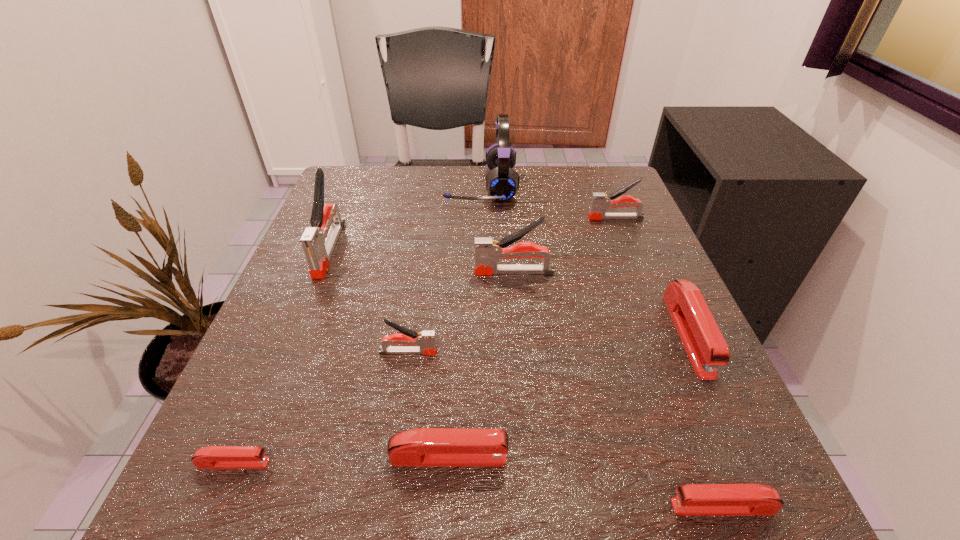
I want to click on unoccupied position between the smallest gray stapler and the nearest object, so click(565, 429).

Find the location of `unoccupied area between the second red stapler from left to right and the nearest object`. unoccupied area between the second red stapler from left to right and the nearest object is located at coordinates (586, 482).

Find the location of `vacant point located between the sixth shortest stapler and the biggest red stapler`. vacant point located between the sixth shortest stapler and the biggest red stapler is located at coordinates (652, 276).

Locate an element on the screen. The height and width of the screenshot is (540, 960). unoccupied area between the shortest object and the leftmost gray stapler is located at coordinates (281, 356).

Identify which object is located as the nearest to the leftmost gray stapler. Please provide its 2D coordinates. Your answer should be formatted as a tuple, i.e. [(x, y)], where the tuple contains the x and y coordinates of a point satisfying the conditions above.

[(426, 340)]

Where is `object that can be found as the fifth closest to the shortest stapler`? object that can be found as the fifth closest to the shortest stapler is located at coordinates (693, 499).

Find the location of `the sixth closest stapler to the nearest stapler`. the sixth closest stapler to the nearest stapler is located at coordinates (600, 202).

Point out which stapler is positioned as the fourth nearest to the nearest gray stapler. Please provide its 2D coordinates. Your answer should be formatted as a tuple, i.e. [(x, y)], where the tuple contains the x and y coordinates of a point satisfying the conditions above.

[(318, 244)]

Identify which gray stapler is located as the nearest to the biggest red stapler. Please provide its 2D coordinates. Your answer should be formatted as a tuple, i.e. [(x, y)], where the tuple contains the x and y coordinates of a point satisfying the conditions above.

[(487, 251)]

Locate which gray stapler ranks in proximity to the biggest gray stapler. Please provide its 2D coordinates. Your answer should be formatted as a tuple, i.e. [(x, y)], where the tuple contains the x and y coordinates of a point satisfying the conditions above.

[(426, 340)]